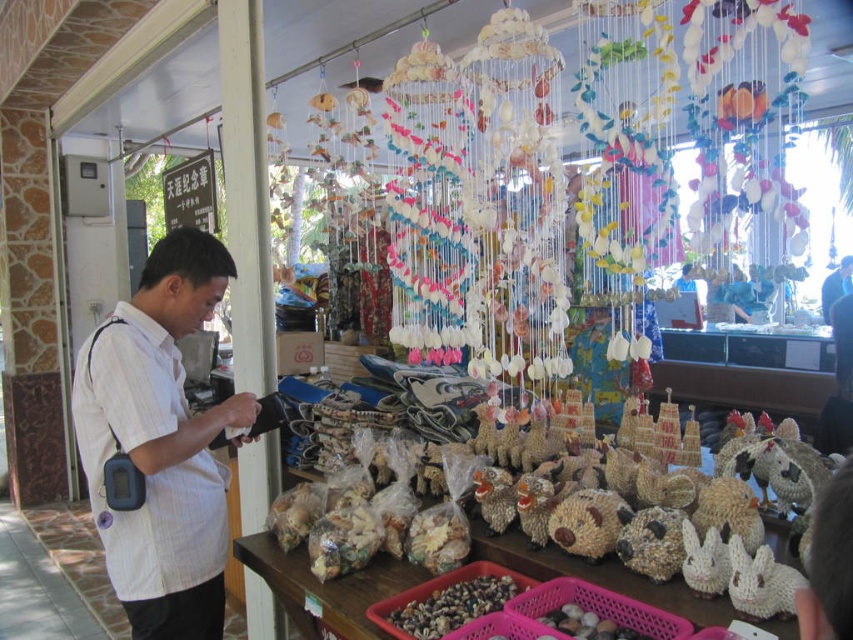
Question: Which point appears farthest from the camera in this image?

Choices:
 (A) (579, 637)
 (B) (390, 572)
 (C) (409, 625)
 (D) (136, 428)

Answer: (B)

Question: Is white striped shirt at left positioned behind natural seashells at center?

Choices:
 (A) yes
 (B) no

Answer: (A)

Question: Based on their relative distances, which object is farther from the smooth brown shells at lower center?

Choices:
 (A) brown woven baskets at center
 (B) natural seashells at center

Answer: (B)

Question: Which object appears farthest from the camera in this image?

Choices:
 (A) natural seashells at center
 (B) smooth brown shells at lower center

Answer: (B)

Question: Can you confirm if white striped shirt at left is thinner than brown woven baskets at center?

Choices:
 (A) no
 (B) yes

Answer: (B)

Question: Does white striped shirt at left appear under brown woven baskets at center?

Choices:
 (A) yes
 (B) no

Answer: (B)